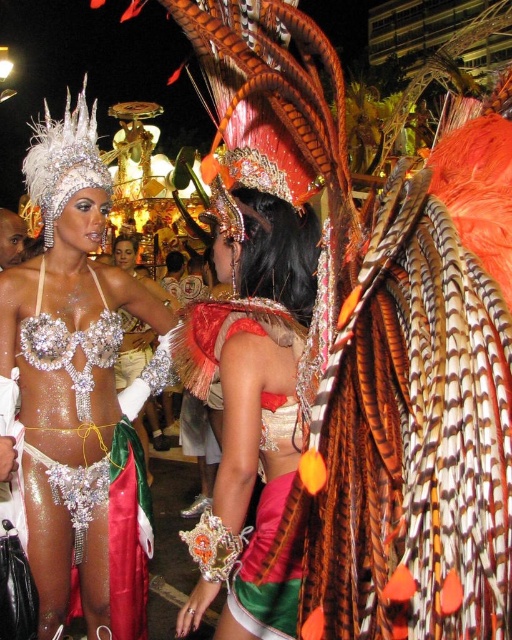
Can you confirm if shiny silver bikini top at center is bigger than shiny metallic bikini top at center?

Indeed, shiny silver bikini top at center has a larger size compared to shiny metallic bikini top at center.

Which is in front, point (20, 280) or point (233, 586)?

Point (233, 586)

In order to click on shiny silver bikini top at center in this screenshot , I will do `click(79, 392)`.